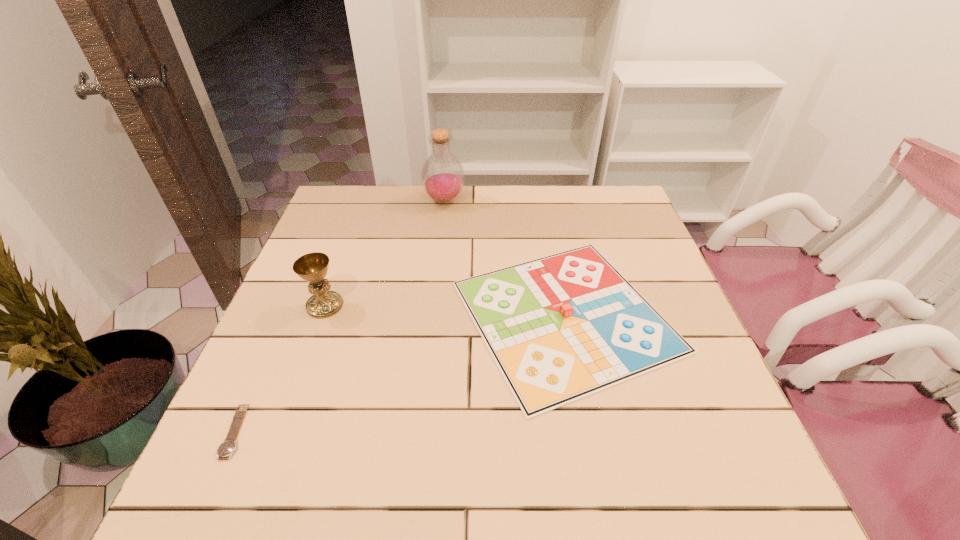
At what (x,y) coordinates should I click in order to perform the action: click on free space between the watch and the second object from left to right. Please return your answer as a coordinate pair (x, y). The width and height of the screenshot is (960, 540). Looking at the image, I should click on (280, 368).

Identify the location of free space between the leftmost object and the tallest object. (341, 316).

What are the coordinates of `vacant area that lies between the chalice and the tallest object` in the screenshot? It's located at (385, 253).

Locate an element on the screen. object that can be found as the second closest to the tallest object is located at coordinates (312, 267).

Locate an element on the screen. object that can be found as the third closest to the second object from left to right is located at coordinates (442, 175).

The height and width of the screenshot is (540, 960). I want to click on free location that satisfies the following two spatial constraints: 1. on the back side of the farthest object; 2. on the right side of the third shortest object, so click(363, 201).

Where is `blank space that satisfies the following two spatial constraints: 1. on the front side of the gameboard; 2. on the left side of the third shortest object`? blank space that satisfies the following two spatial constraints: 1. on the front side of the gameboard; 2. on the left side of the third shortest object is located at coordinates (322, 316).

I want to click on free space that satisfies the following two spatial constraints: 1. on the back side of the bottle; 2. on the left side of the shortest object, so click(x=338, y=201).

Locate an element on the screen. free space that satisfies the following two spatial constraints: 1. on the back side of the leftmost object; 2. on the right side of the third shortest object is located at coordinates (292, 306).

This screenshot has height=540, width=960. I want to click on vacant space that satisfies the following two spatial constraints: 1. on the back side of the second tallest object; 2. on the right side of the bottle, so click(x=363, y=201).